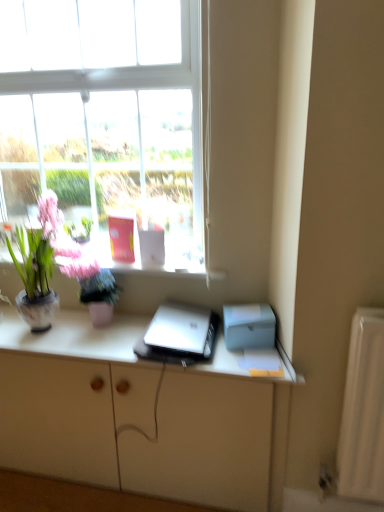
Question: In terms of width, does matte ceramic vase at left look wider or thinner when compared to transparent glass window at upper center?

Choices:
 (A) wide
 (B) thin

Answer: (B)

Question: Is matte ceramic vase at left bigger or smaller than transparent glass window at upper center?

Choices:
 (A) small
 (B) big

Answer: (A)

Question: Based on their relative distances, which object is nearer to the transparent glass window at upper center?

Choices:
 (A) matte white cabinet at center
 (B) silver metallic laptop at center
 (C) silver metallic laptop at center
 (D) matte ceramic vase at left

Answer: (D)

Question: Based on their relative distances, which object is nearer to the silver metallic laptop at center?

Choices:
 (A) transparent glass window at upper center
 (B) silver metallic laptop at center
 (C) matte ceramic vase at left
 (D) matte white cabinet at center

Answer: (B)